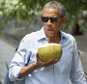
Locate an element on the screen. The height and width of the screenshot is (84, 87). shades is located at coordinates (53, 18).